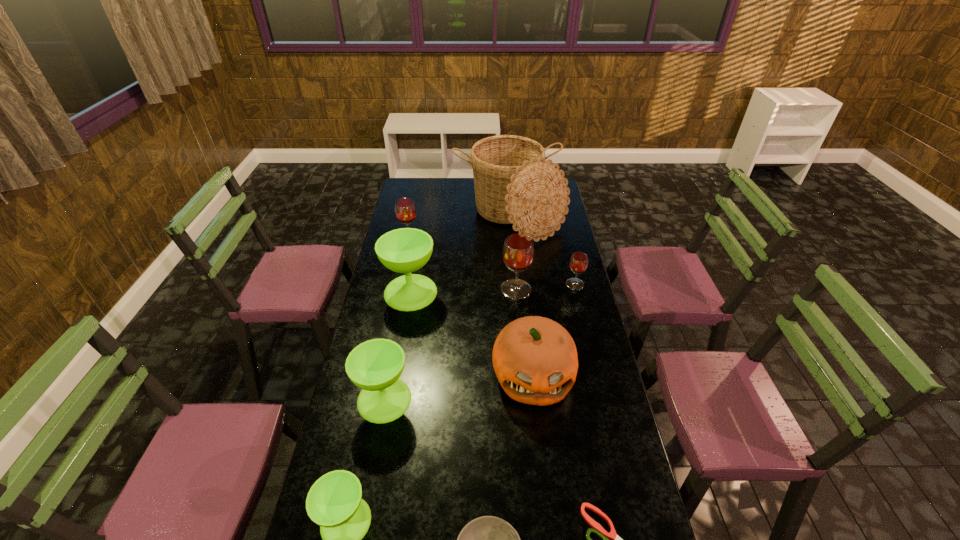
The height and width of the screenshot is (540, 960). I want to click on blank region between the basket and the second nearest wineglass, so click(x=447, y=309).

Identify which object is the eighth nearest to the second red wineglass from right to left. Please provide its 2D coordinates. Your answer should be formatted as a tuple, i.e. [(x, y)], where the tuple contains the x and y coordinates of a point satisfying the conditions above.

[(488, 539)]

Where is `the seventh closest object to the rightmost red wineglass`? The image size is (960, 540). the seventh closest object to the rightmost red wineglass is located at coordinates (598, 529).

Choose which wineglass is the fourth nearest neighbor to the biggest green wineglass. Please provide its 2D coordinates. Your answer should be formatted as a tuple, i.e. [(x, y)], where the tuple contains the x and y coordinates of a point satisfying the conditions above.

[(578, 263)]

Identify which wineglass is the sixth nearest to the tallest object. Please provide its 2D coordinates. Your answer should be formatted as a tuple, i.e. [(x, y)], where the tuple contains the x and y coordinates of a point satisfying the conditions above.

[(334, 502)]

I want to click on the third closest red wineglass to the smallest green wineglass, so click(405, 210).

Select which red wineglass is the second closest to the biggest red wineglass. Please provide its 2D coordinates. Your answer should be formatted as a tuple, i.e. [(x, y)], where the tuple contains the x and y coordinates of a point satisfying the conditions above.

[(405, 210)]

Find the location of a particular element. The image size is (960, 540). green wineglass that is the nearest to the second biggest green wineglass is located at coordinates (334, 502).

Find the location of `green wineglass that is the third closest to the pumpkin`. green wineglass that is the third closest to the pumpkin is located at coordinates (334, 502).